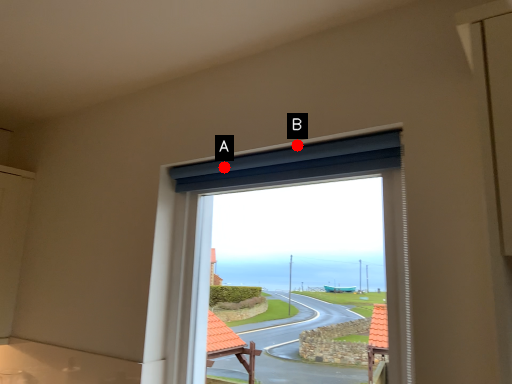
Question: Two points are circled on the image, labeled by A and B beside each circle. Which point appears closest to the camera in this image?

Choices:
 (A) A is closer
 (B) B is closer

Answer: (B)